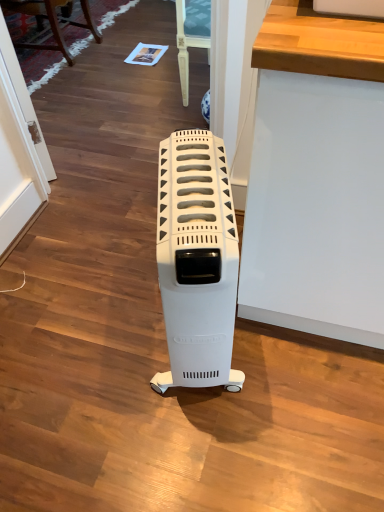
Locate an element on the screen. free space to the left of white plastic heater at center is located at coordinates (102, 345).